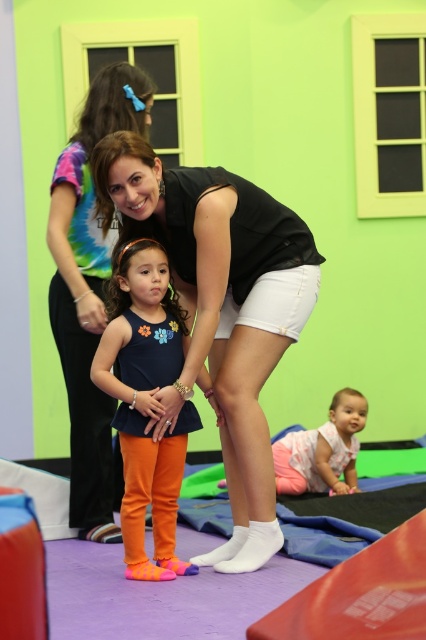
Question: Estimate the real-world distances between objects in this image. Which object is farther from the matte black tank top at center?

Choices:
 (A) pink cotton baby at lower center
 (B) matte orange leggings at center

Answer: (A)

Question: Which is farther from the matte black tank top at center?

Choices:
 (A) matte orange leggings at center
 (B) pink cotton baby at lower center
 (C) black matte tank top at center

Answer: (B)

Question: Which object appears closest to the camera in this image?

Choices:
 (A) black matte tank top at center
 (B) matte black tank top at center
 (C) matte orange leggings at center

Answer: (A)

Question: Does black matte tank top at center appear under matte orange leggings at center?

Choices:
 (A) yes
 (B) no

Answer: (B)

Question: Observing the image, what is the correct spatial positioning of black matte tank top at center in reference to matte orange leggings at center?

Choices:
 (A) below
 (B) above

Answer: (B)

Question: In this image, where is black matte tank top at center located relative to matte orange leggings at center?

Choices:
 (A) above
 (B) below

Answer: (A)